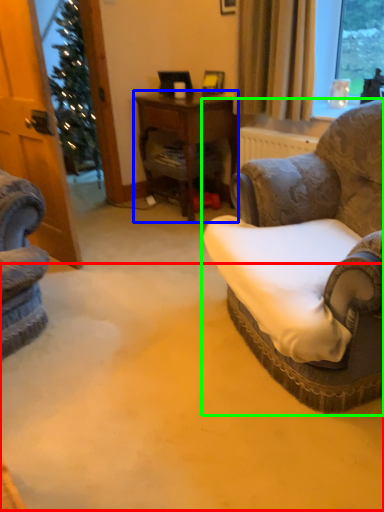
Question: Which object is positioned closest to plain (highlighted by a red box)? Select from desk (highlighted by a blue box) and chair (highlighted by a green box).

Choices:
 (A) desk
 (B) chair

Answer: (B)